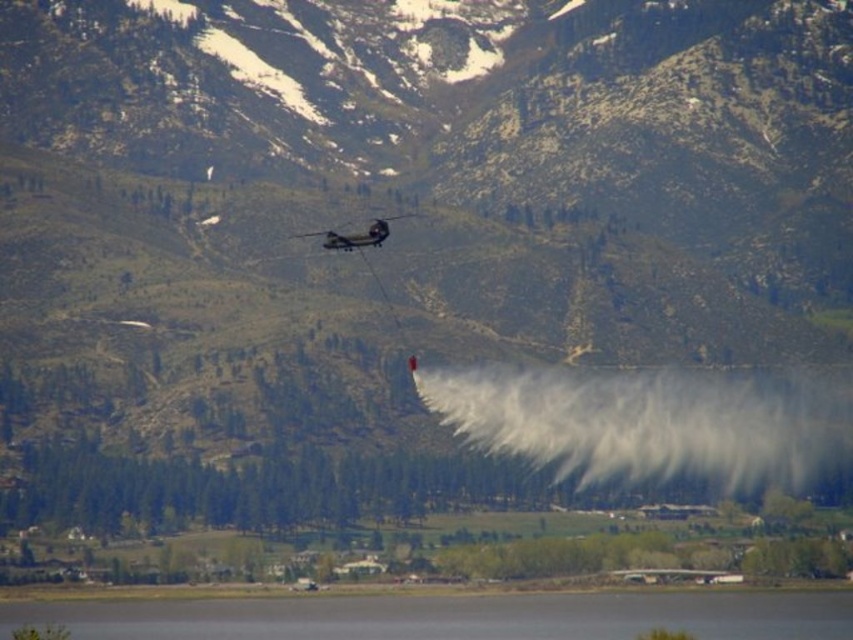
Question: Does transparent water at lower center lie in front of metallic gray helicopter at center?

Choices:
 (A) yes
 (B) no

Answer: (B)

Question: Which object is farther from the camera taking this photo?

Choices:
 (A) transparent water at lower center
 (B) metallic gray helicopter at center

Answer: (A)

Question: Is transparent water at lower center in front of metallic gray helicopter at center?

Choices:
 (A) no
 (B) yes

Answer: (A)

Question: Is transparent water at lower center bigger than metallic gray helicopter at center?

Choices:
 (A) no
 (B) yes

Answer: (B)